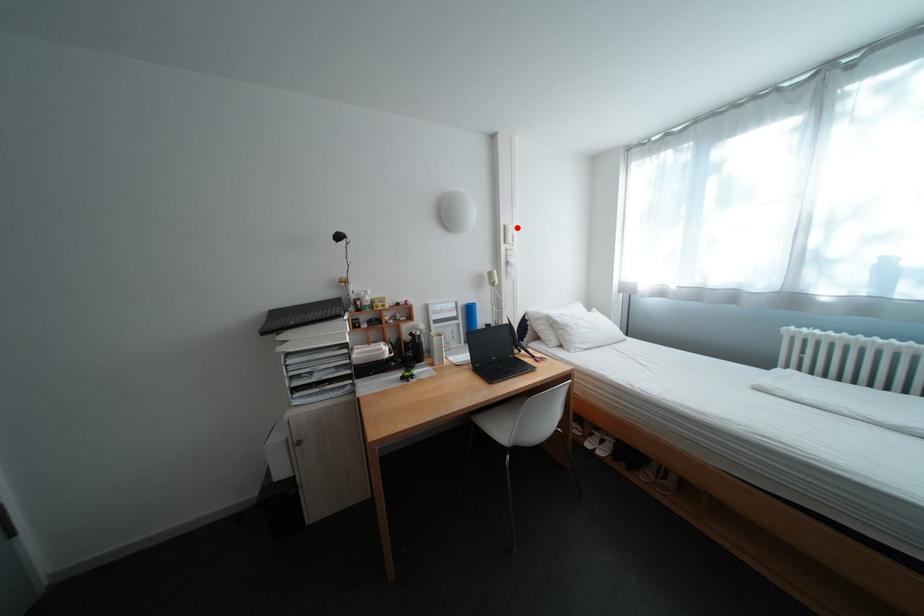
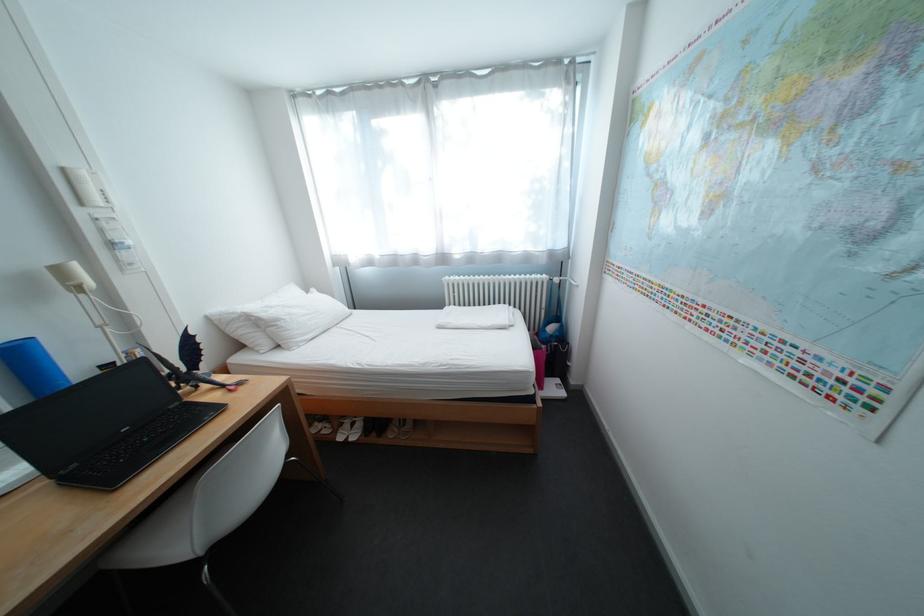
Question: A red point is marked in image1. In image2, is the corresponding 3D point closer to the camera or farther? Reply with the corresponding letter.

Choices:
 (A) The corresponding 3D point is closer.
 (B) The corresponding 3D point is farther.

Answer: (B)